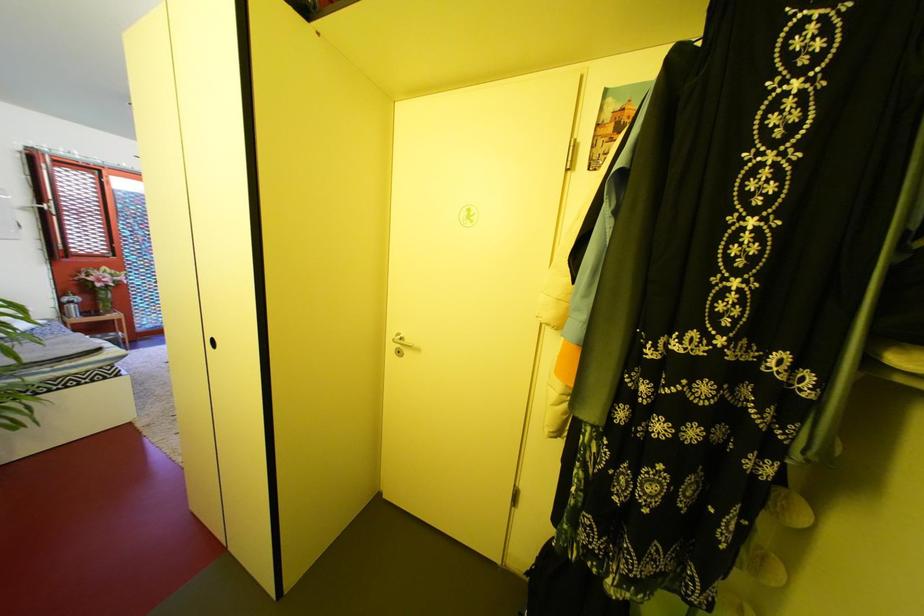
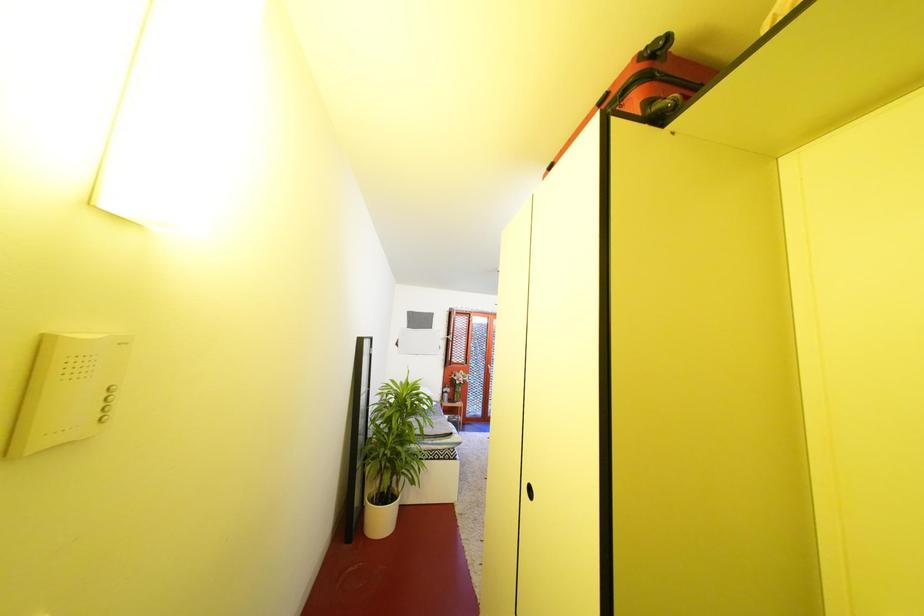
How did the camera likely rotate?

The camera rotated toward left-up.